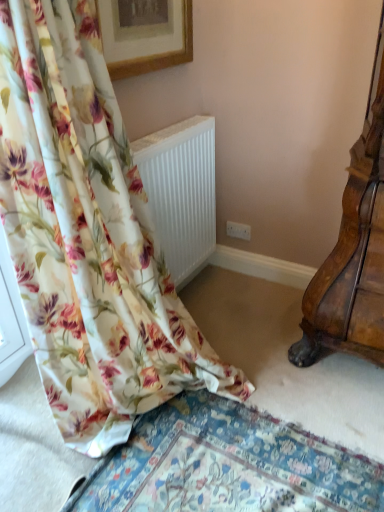
Question: Looking at their shapes, would you say wooden picture frame at upper center is wider or thinner than white ribbed radiator at lower left?

Choices:
 (A) thin
 (B) wide

Answer: (A)

Question: From the image's perspective, is wooden picture frame at upper center located above or below white ribbed radiator at lower left?

Choices:
 (A) below
 (B) above

Answer: (B)

Question: Which object is the farthest from the floral fabric curtain at left?

Choices:
 (A) white ribbed radiator at lower left
 (B) wooden picture frame at upper center

Answer: (B)

Question: Which object is positioned closest to the white ribbed radiator at lower left?

Choices:
 (A) wooden picture frame at upper center
 (B) floral fabric curtain at left

Answer: (A)